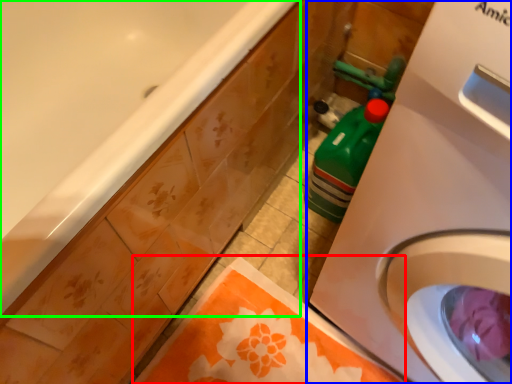
Question: Based on their relative distances, which object is nearer to beach towel (highlighted by a red box)? Choose from washing machine (highlighted by a blue box) and bathtub (highlighted by a green box).

Choices:
 (A) washing machine
 (B) bathtub

Answer: (A)